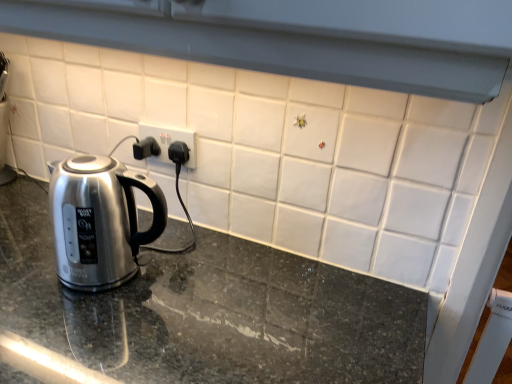
Image resolution: width=512 pixels, height=384 pixels. I want to click on free point in front of satin metallic kettle at left, so click(74, 339).